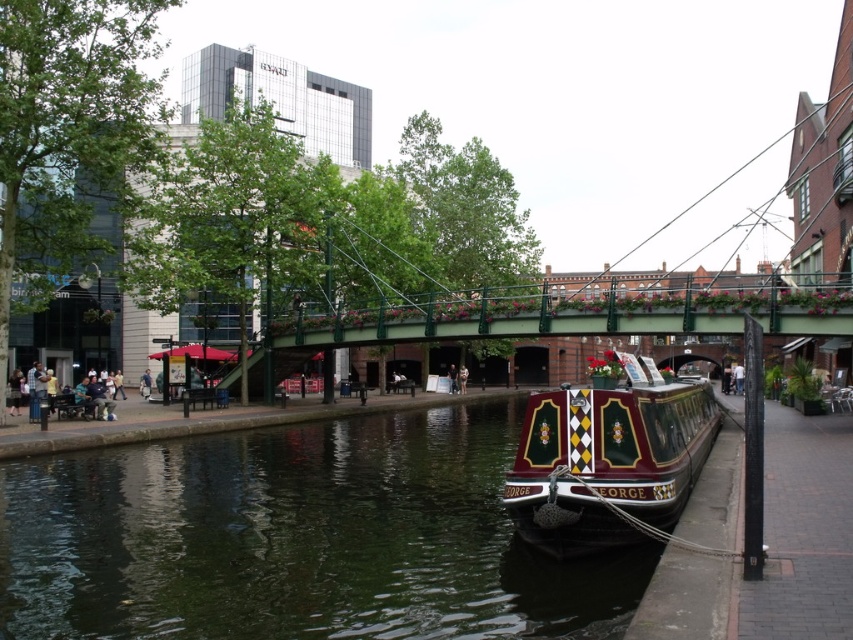
You are standing on the pedestrian bridge and see the point marked at coordinates (297, 538). What is located at that point?

The point at coordinates (297, 538) is occupied by green smooth water at lower center.

You are standing on the pedestrian bridge with pink flowers and want to walk to the canal boat named George. You see two points marked on the ground ahead of you. One is at point [131,573] and the other at point [573,445]. Which point should you step on first to reach the boat George?

You should step on point [573,445] first because point [131,573] is behind it, so stepping on the closer point [573,445] first will lead you towards the boat George.